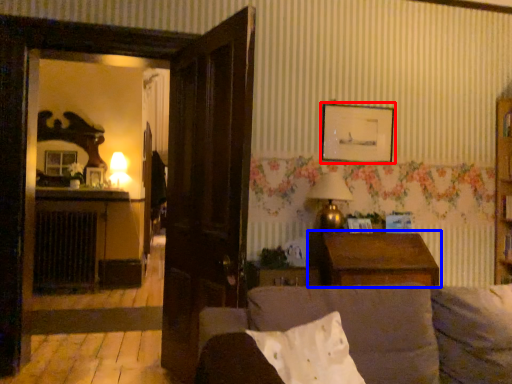
Question: Among these objects, which one is nearest to the camera, picture frame (highlighted by a red box) or table (highlighted by a blue box)?

Choices:
 (A) picture frame
 (B) table

Answer: (B)